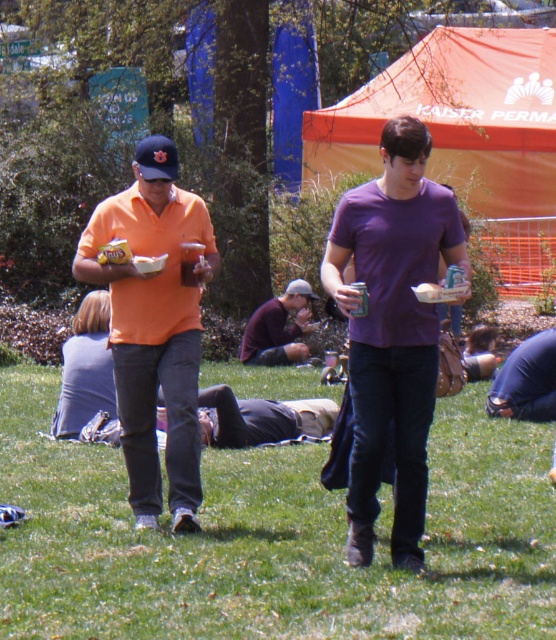
Is green grass at center shorter than matte orange shirt at center?

Indeed, green grass at center has a lesser height compared to matte orange shirt at center.

Which is behind, point (33, 490) or point (141, 477)?

Point (33, 490)

Identify the location of green grass at center. (272, 538).

Is point (370, 184) positioned before point (309, 328)?

Yes, it is in front of point (309, 328).

Can you confirm if purple cotton shirt at center is bigger than dark purple shirt at center?

Correct, purple cotton shirt at center is larger in size than dark purple shirt at center.

Who is more forward, (x=332, y=264) or (x=272, y=326)?

Positioned in front is point (x=332, y=264).

What are the coordinates of `purple cotton shirt at center` in the screenshot? It's located at (391, 330).

Which of these two, green grass at center or purple cotton shirt at center, stands shorter?

Standing shorter between the two is green grass at center.

Does point (360, 582) lie behind point (341, 204)?

No, it is in front of (341, 204).

This screenshot has height=640, width=556. What are the coordinates of `green grass at center` in the screenshot? It's located at (272, 538).